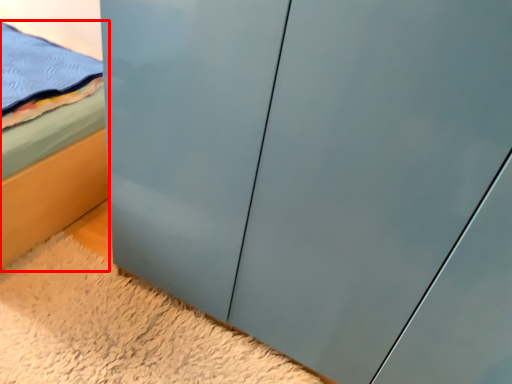
Question: From the image's perspective, considering the relative positions of bed (annotated by the red box) and plain in the image provided, where is bed (annotated by the red box) located with respect to the staircase?

Choices:
 (A) above
 (B) below

Answer: (A)